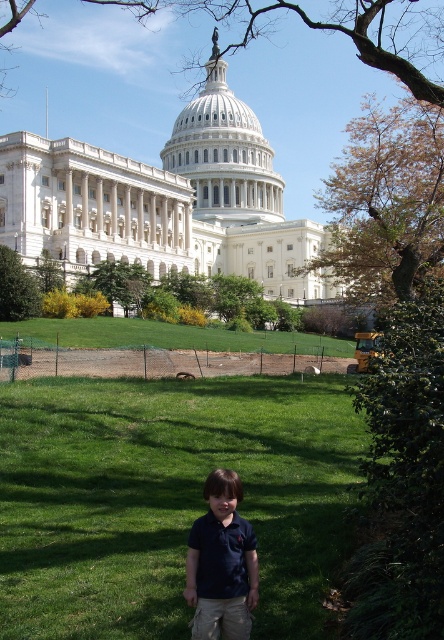
In the scene shown: Can you confirm if brown leafy tree at upper center is taller than green leafy tree at center?

Indeed, brown leafy tree at upper center has a greater height compared to green leafy tree at center.

Who is higher up, brown leafy tree at upper center or green leafy tree at center?

brown leafy tree at upper center is higher up.

Which is in front, point (416, 0) or point (119, 291)?

Point (119, 291) is more forward.

I want to click on brown leafy tree at upper center, so click(x=330, y=29).

How distant is brown textured tree at upper right from brown leafy tree at upper center?

A distance of 29.75 meters exists between brown textured tree at upper right and brown leafy tree at upper center.

Is the position of brown textured tree at upper right more distant than that of brown leafy tree at upper center?

Yes, it is behind brown leafy tree at upper center.

Image resolution: width=444 pixels, height=640 pixels. In order to click on brown textured tree at upper right in this screenshot , I will do pos(385,202).

Does green leafy tree at lower left have a lesser width compared to green leafy tree at center?

Yes, green leafy tree at lower left is thinner than green leafy tree at center.

Which of these two, green leafy tree at lower left or green leafy tree at center, stands taller?

green leafy tree at lower left is taller.

Find the location of a particular element. green leafy tree at lower left is located at coordinates (16, 289).

The height and width of the screenshot is (640, 444). I want to click on green leafy tree at lower left, so click(16, 289).